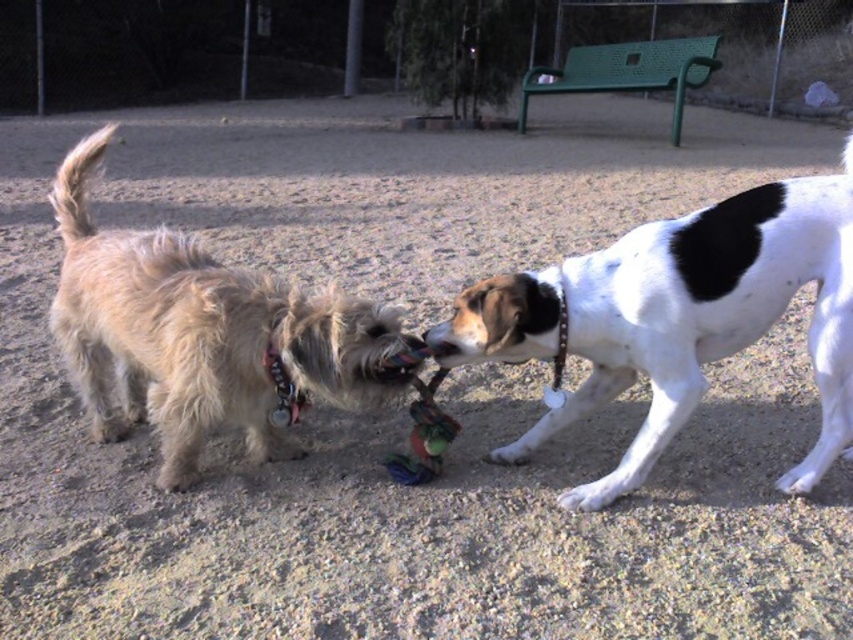
Question: Which point appears closest to the camera in this image?

Choices:
 (A) (601, 260)
 (B) (155, 365)

Answer: (A)

Question: Is white smooth dog at right wider than light brown fur at left?

Choices:
 (A) yes
 (B) no

Answer: (B)

Question: Does white smooth dog at right appear on the left side of light brown fur at left?

Choices:
 (A) no
 (B) yes

Answer: (A)

Question: Which point is closer to the camera?

Choices:
 (A) white smooth dog at right
 (B) light brown fur at left

Answer: (B)

Question: Considering the relative positions of white smooth dog at right and light brown fur at left in the image provided, where is white smooth dog at right located with respect to light brown fur at left?

Choices:
 (A) below
 (B) above

Answer: (A)